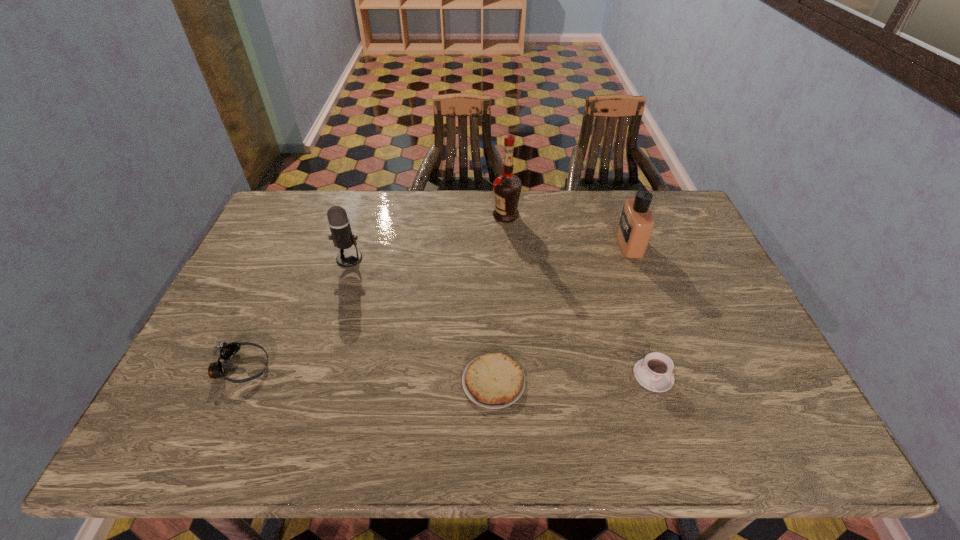
Find the location of `blank space that satisfies the following two spatial constraints: 1. through the lenses of the leftmost object; 2. on the back side of the tortilla`. blank space that satisfies the following two spatial constraints: 1. through the lenses of the leftmost object; 2. on the back side of the tortilla is located at coordinates pos(235,382).

Where is `free spot that satisfies the following two spatial constraints: 1. through the lenses of the leftmost object; 2. on the left side of the tortilla`? This screenshot has height=540, width=960. free spot that satisfies the following two spatial constraints: 1. through the lenses of the leftmost object; 2. on the left side of the tortilla is located at coordinates tap(235, 382).